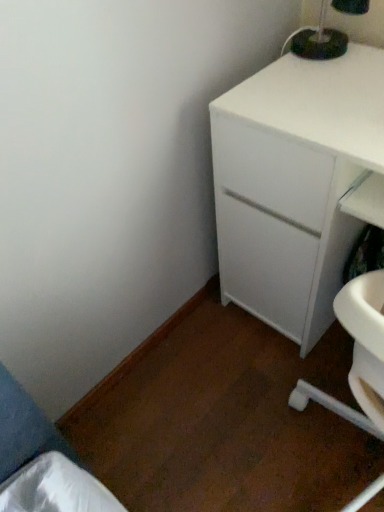
You are a GUI agent. You are given a task and a screenshot of the screen. Output one action in this format:
    pyautogui.click(x=<x>, y=<y>)
    Task: Click on the free space above white matte cabinet at upper right (from a real-world perspective)
    
    Given the screenshot: What is the action you would take?
    pyautogui.click(x=328, y=89)